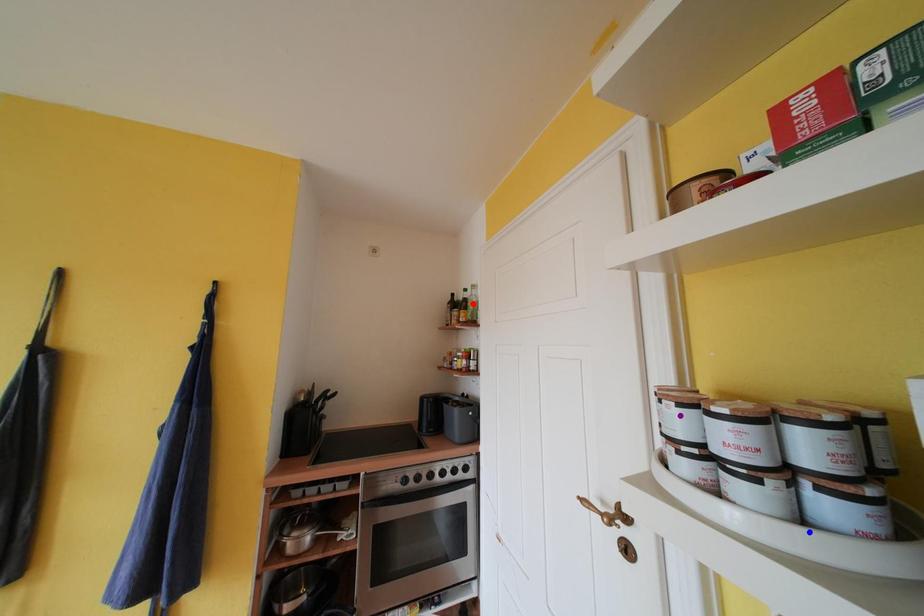
Order these from nearest to farthest:
blue point | red point | purple point

blue point
purple point
red point